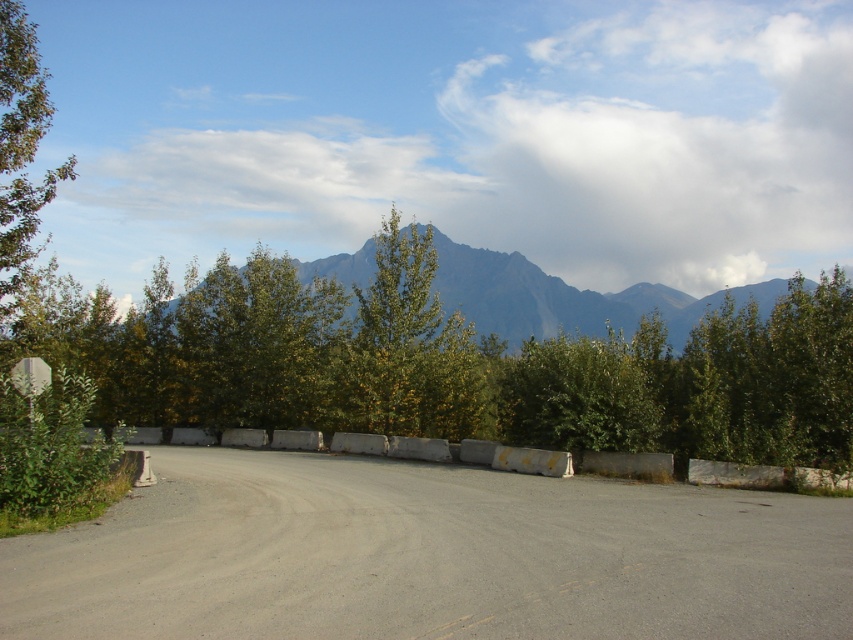
Question: Which point is closer to the camera?

Choices:
 (A) green textured mountain at center
 (B) gray asphalt dirt track at center
 (C) green leafy tree at left
 (D) concrete barrier at center

Answer: (B)

Question: Which of the following is the farthest from the observer?

Choices:
 (A) (51, 180)
 (B) (341, 282)
 (C) (581, 456)
 (D) (596, 612)

Answer: (A)

Question: Can you confirm if green leafy tree at center is wider than concrete barrier at center?

Choices:
 (A) no
 (B) yes

Answer: (B)

Question: Does green leafy tree at center come in front of green textured mountain at center?

Choices:
 (A) no
 (B) yes

Answer: (B)

Question: Based on their relative distances, which object is nearer to the gray asphalt dirt track at center?

Choices:
 (A) green textured mountain at center
 (B) green leafy tree at left
 (C) concrete barrier at center

Answer: (C)

Question: Can you confirm if green leafy tree at center is bigger than green leafy tree at left?

Choices:
 (A) no
 (B) yes

Answer: (A)